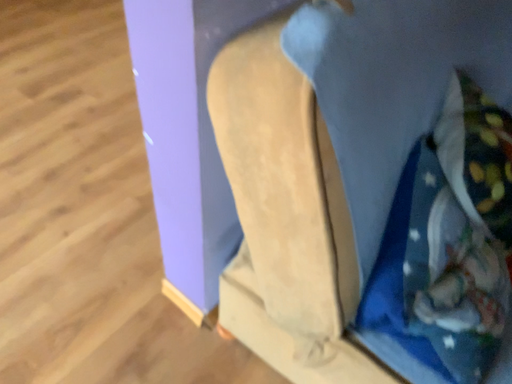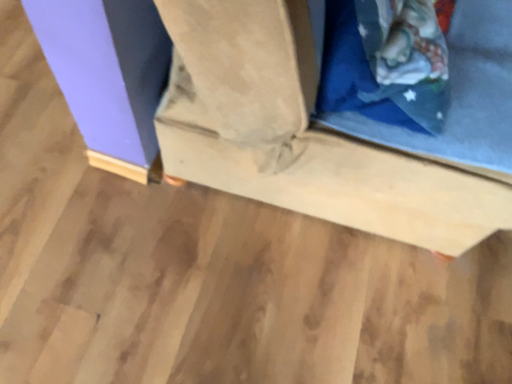
Question: How did the camera likely rotate when shooting the video?

Choices:
 (A) rotated downward
 (B) rotated upward

Answer: (A)